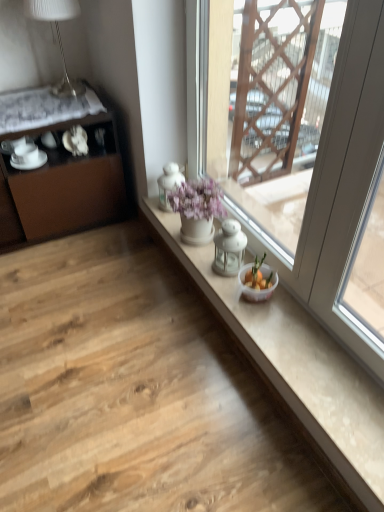
This screenshot has width=384, height=512. I want to click on white glossy table lamp at upper left, so click(x=57, y=36).

This screenshot has width=384, height=512. What do you see at coordinates (65, 184) in the screenshot?
I see `brown matte cabinet at left` at bounding box center [65, 184].

The height and width of the screenshot is (512, 384). Identify the location of white glass window at center. (299, 146).

In the image, is white glossy table lamp at upper left positioned in front of or behind white porcelain saucer at left, the 1th tableware from the right?

In the image, white glossy table lamp at upper left appears in front of white porcelain saucer at left, the 1th tableware from the right.

Is white porcelain saucer at left, the 1th tableware from the right, inside white glossy table lamp at upper left?

No, white porcelain saucer at left, the 1th tableware from the right, is not a part of white glossy table lamp at upper left.

From the image's perspective, is white glossy table lamp at upper left located above or below white porcelain saucer at left, which appears as the 2th tableware when viewed from the left?

white glossy table lamp at upper left is situated higher than white porcelain saucer at left, which appears as the 2th tableware when viewed from the left, in the image.

Between white glossy table lamp at upper left and white porcelain saucer at left, the 1th tableware from the right, which one has smaller width?

white porcelain saucer at left, the 1th tableware from the right, is thinner.

From the image's perspective, is white glossy table lamp at upper left above or below brown matte cabinet at left?

white glossy table lamp at upper left is above brown matte cabinet at left.

Is there a large distance between white glossy table lamp at upper left and brown matte cabinet at left?

Actually, white glossy table lamp at upper left and brown matte cabinet at left are a little close together.

Which of these two, white glossy table lamp at upper left or brown matte cabinet at left, is thinner?

white glossy table lamp at upper left is thinner.

Measure the distance from white glossy table lamp at upper left to brown matte cabinet at left.

white glossy table lamp at upper left is 15.61 inches away from brown matte cabinet at left.

Can you confirm if white glossy counter top at center is smaller than white porcelain saucer at left, the 1th tableware from the right?

Incorrect, white glossy counter top at center is not smaller in size than white porcelain saucer at left, the 1th tableware from the right.

Is white glossy counter top at center aimed at white porcelain saucer at left, which appears as the 2th tableware when viewed from the left?

No, white glossy counter top at center is not facing towards white porcelain saucer at left, which appears as the 2th tableware when viewed from the left.

From the picture: Is white glossy counter top at center touching white porcelain saucer at left, the 1th tableware from the right?

No, white glossy counter top at center is not in contact with white porcelain saucer at left, the 1th tableware from the right.

From a real-world perspective, is white porcelain saucer at left, which appears as the 2th tableware when viewed from the left, on top of brown matte cabinet at left?

Yes, from a real-world perspective, white porcelain saucer at left, which appears as the 2th tableware when viewed from the left, is on top of brown matte cabinet at left.

Consider the image. Considering the relative sizes of white porcelain saucer at left, which appears as the 2th tableware when viewed from the left, and brown matte cabinet at left in the image provided, is white porcelain saucer at left, which appears as the 2th tableware when viewed from the left, taller than brown matte cabinet at left?

Incorrect, the height of white porcelain saucer at left, which appears as the 2th tableware when viewed from the left, is not larger of that of brown matte cabinet at left.

Is white porcelain saucer at left, which appears as the 2th tableware when viewed from the left, far away from brown matte cabinet at left?

No, there isn't a large distance between white porcelain saucer at left, which appears as the 2th tableware when viewed from the left, and brown matte cabinet at left.

Looking at the image, does white porcelain saucer at left, the 1th tableware from the right, seem bigger or smaller compared to brown matte cabinet at left?

In the image, white porcelain saucer at left, the 1th tableware from the right, appears to be smaller than brown matte cabinet at left.

From a real-world perspective, which is physically below, white porcelain saucer at left, which appears as the 2th tableware when viewed from the left, or white glossy counter top at center?

white glossy counter top at center is physically lower.

Does white porcelain saucer at left, which appears as the 2th tableware when viewed from the left, have a greater height compared to white glossy counter top at center?

Yes.

From the image's perspective, is white porcelain saucer at left, which appears as the 2th tableware when viewed from the left, located beneath white glossy counter top at center?

No, from the image's perspective, white porcelain saucer at left, which appears as the 2th tableware when viewed from the left, is not below white glossy counter top at center.

Considering the relative sizes of brown matte cabinet at left and white glossy table lamp at upper left in the image provided, is brown matte cabinet at left smaller than white glossy table lamp at upper left?

Incorrect, brown matte cabinet at left is not smaller in size than white glossy table lamp at upper left.

Is brown matte cabinet at left closer to the viewer compared to white glossy table lamp at upper left?

Yes, it is in front of white glossy table lamp at upper left.

In the scene shown: From the image's perspective, between brown matte cabinet at left and white glossy table lamp at upper left, who is located below?

brown matte cabinet at left is shown below in the image.

Would you say brown matte cabinet at left is a long distance from white glossy table lamp at upper left?

brown matte cabinet at left is actually quite close to white glossy table lamp at upper left.

Is white glass window at center not close to brown matte cabinet at left?

No, there isn't a large distance between white glass window at center and brown matte cabinet at left.

Measure the distance from white glass window at center to brown matte cabinet at left.

white glass window at center and brown matte cabinet at left are 69.86 centimeters apart from each other.

Locate an element on the screen. The width and height of the screenshot is (384, 512). window above the brown matte cabinet at left (from a real-world perspective) is located at coordinates (299, 146).

Identify the location of table lamp in front of the white porcelain saucer at left, which appears as the 2th tableware when viewed from the left. Image resolution: width=384 pixels, height=512 pixels. (57, 36).

Image resolution: width=384 pixels, height=512 pixels. In order to click on table lamp on the right of brown matte cabinet at left in this screenshot , I will do `click(57, 36)`.

Which object lies nearer to the anchor point white porcelain saucer at left, which appears as the 2th tableware when viewed from the left, white glossy counter top at center or brown matte cabinet at left?

brown matte cabinet at left.

From the image, which object appears to be nearer to white glossy counter top at center, white glossy teacup at left, the first tableware positioned from the left, or white glossy table lamp at upper left?

white glossy table lamp at upper left is positioned closer to the anchor white glossy counter top at center.

Considering their positions, is white glossy teacup at left, arranged as the 2th tableware when viewed from the right, positioned further to white glass window at center than brown matte cabinet at left?

white glossy teacup at left, arranged as the 2th tableware when viewed from the right, is further to white glass window at center.

Looking at the image, which one is located further to white porcelain saucer at left, which appears as the 2th tableware when viewed from the left, white glossy teacup at left, the first tableware positioned from the left, or white glass window at center?

white glass window at center is further to white porcelain saucer at left, which appears as the 2th tableware when viewed from the left.

Considering their positions, is brown matte cabinet at left positioned closer to white porcelain saucer at left, the 1th tableware from the right, than white glossy teacup at left, the first tableware positioned from the left?

Among the two, white glossy teacup at left, the first tableware positioned from the left, is located nearer to white porcelain saucer at left, the 1th tableware from the right.

From the image, which object appears to be farther from white glossy teacup at left, arranged as the 2th tableware when viewed from the right, brown matte cabinet at left or white glossy counter top at center?

white glossy counter top at center is positioned further to the anchor white glossy teacup at left, arranged as the 2th tableware when viewed from the right.

When comparing their distances from white glass window at center, does white glossy table lamp at upper left or brown matte cabinet at left seem further?

Among the two, white glossy table lamp at upper left is located further to white glass window at center.

When comparing their distances from white glossy teacup at left, arranged as the 2th tableware when viewed from the right, does white glass window at center or white porcelain saucer at left, which appears as the 2th tableware when viewed from the left, seem further?

The object further to white glossy teacup at left, arranged as the 2th tableware when viewed from the right, is white glass window at center.

Image resolution: width=384 pixels, height=512 pixels. In order to click on cabinetry located between white glossy teacup at left, the first tableware positioned from the left, and white glossy counter top at center in the left-right direction in this screenshot , I will do `click(65, 184)`.

The image size is (384, 512). Find the location of `table lamp between white glass window at center and white glossy teacup at left, arranged as the 2th tableware when viewed from the right, in the front-back direction`. table lamp between white glass window at center and white glossy teacup at left, arranged as the 2th tableware when viewed from the right, in the front-back direction is located at coordinates (57, 36).

Image resolution: width=384 pixels, height=512 pixels. Find the location of `tableware between white glossy table lamp at upper left and white glossy teacup at left, the first tableware positioned from the left, from top to bottom`. tableware between white glossy table lamp at upper left and white glossy teacup at left, the first tableware positioned from the left, from top to bottom is located at coordinates click(x=76, y=141).

Image resolution: width=384 pixels, height=512 pixels. Find the location of `table lamp positioned between white glass window at center and white porcelain saucer at left, which appears as the 2th tableware when viewed from the left, from near to far`. table lamp positioned between white glass window at center and white porcelain saucer at left, which appears as the 2th tableware when viewed from the left, from near to far is located at coordinates (57, 36).